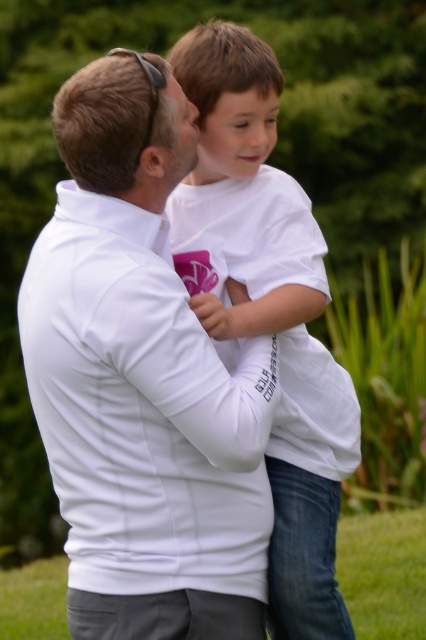
You are a photographer adjusting the focus on your camera. The camera can only focus on one subject at a time. You want to ensure that both the white matte shirt at center and the smooth white face at center are in focus. Given their distance apart, will the camera need to refocus between them?

The white matte shirt at center and the smooth white face at center are 5.57 inches apart from each other. Since they are close in distance, the camera might not need to refocus between them if the depth of field is sufficient to keep both within the focused area.

You are a photographer trying to capture a closeup of the white matte jacket at center and the white matte shirt at center in the image. Which one would appear larger in your photo?

The white matte jacket at center would appear larger in the photo because it is closer to the viewer than the white matte shirt at center.

You are a photographer trying to capture a closeup of the smooth white face at center without including the white matte shirt at center in the frame. Given their relative widths, is this feasible?

The white matte shirt at center is wider than the smooth white face at center. Since the shirt is wider, it might be challenging to frame the face without including part of the shirt, especially if they are positioned closely together.